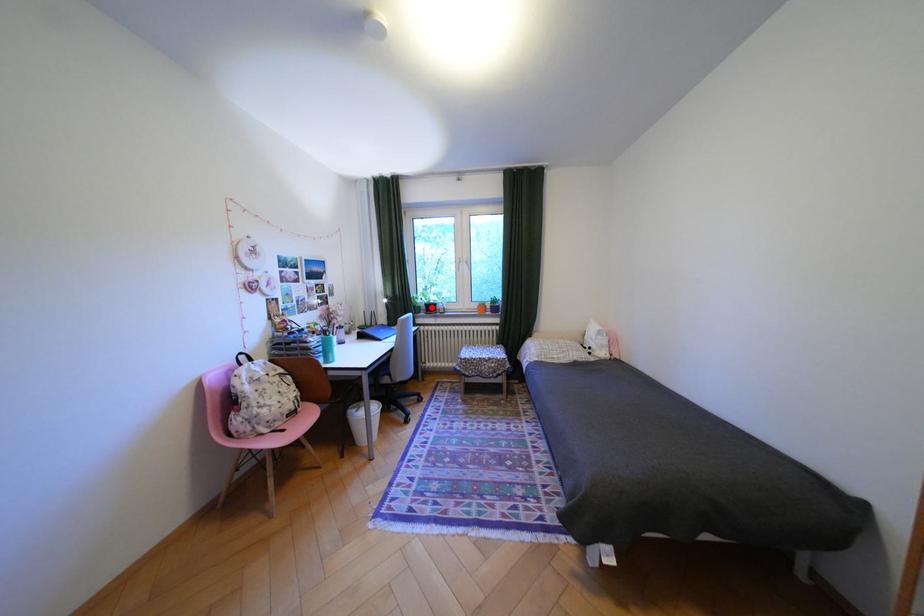
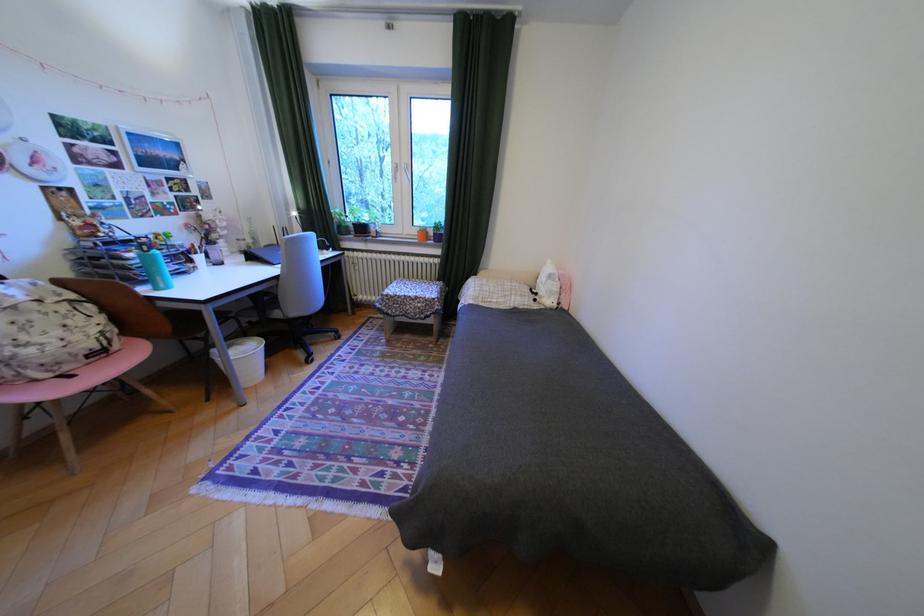
Question: I am providing you with two images of the same scene from different viewpoints. Image1 has a red point marked. In image2, the corresponding 3D location appears at what relative position? Reply with the corresponding letter.

Choices:
 (A) Closer
 (B) Farther

Answer: (A)